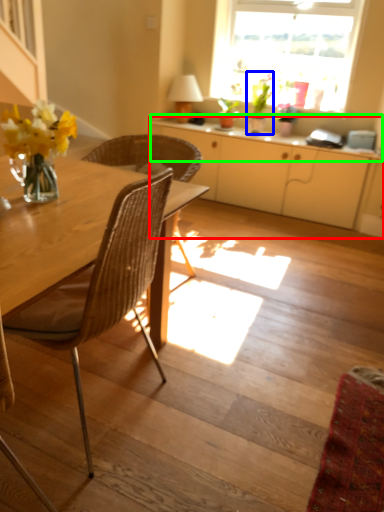
Question: Which object is positioned farthest from cabinetry (highlighted by a red box)? Select from houseplant (highlighted by a blue box) and counter top (highlighted by a green box).

Choices:
 (A) houseplant
 (B) counter top

Answer: (A)